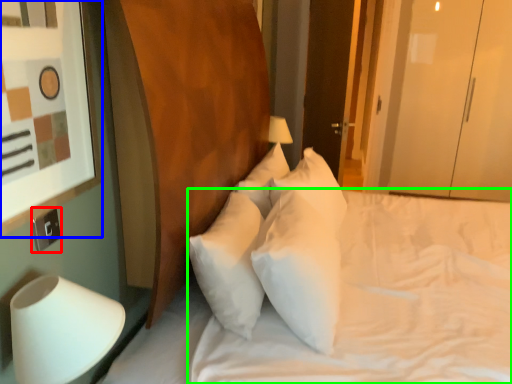
Question: Which object is the closest to the electric outlet (highlighted by a red box)? Choose among these: picture frame (highlighted by a blue box) or mattress (highlighted by a green box).

Choices:
 (A) picture frame
 (B) mattress

Answer: (A)